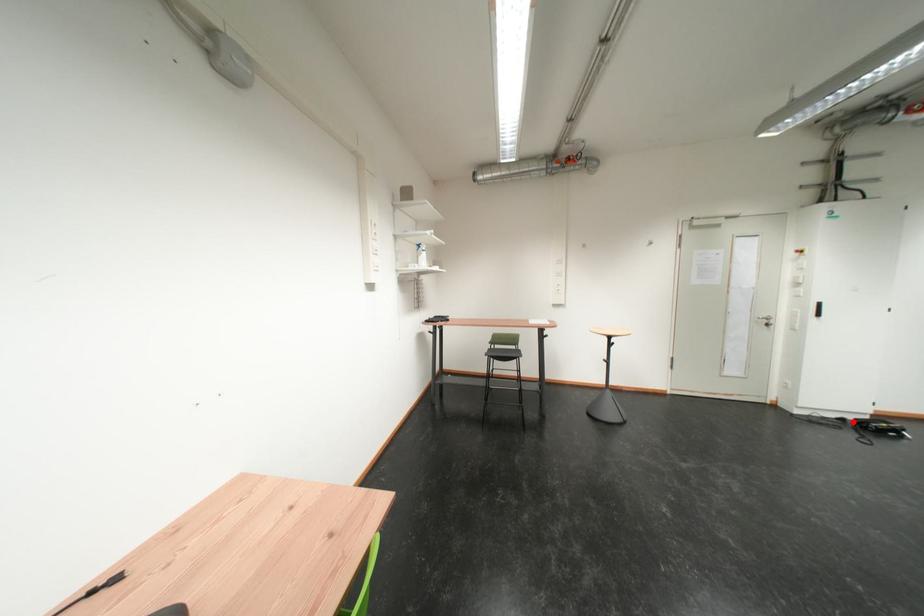
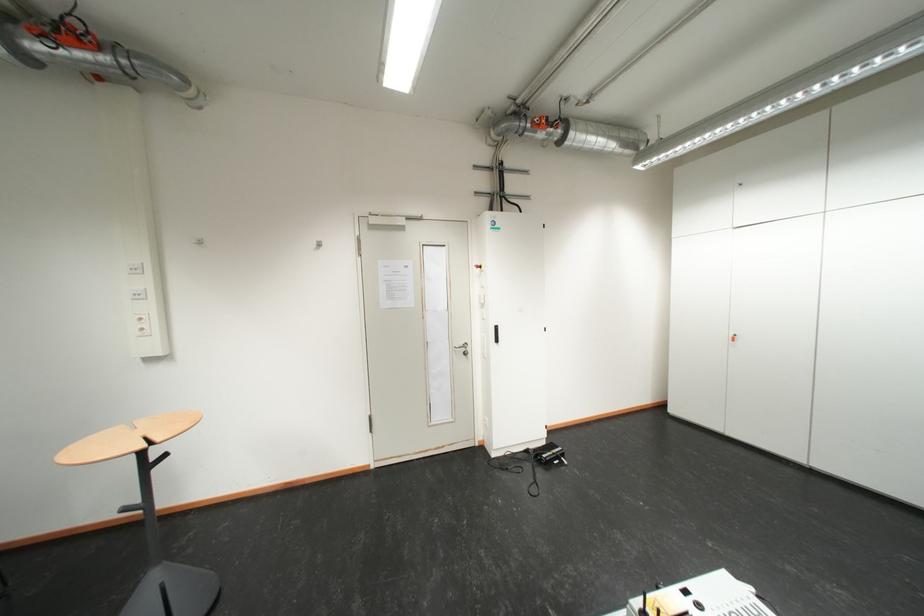
In the second image, find the point that corresponds to the highlighted location in the first image.

(538, 454)